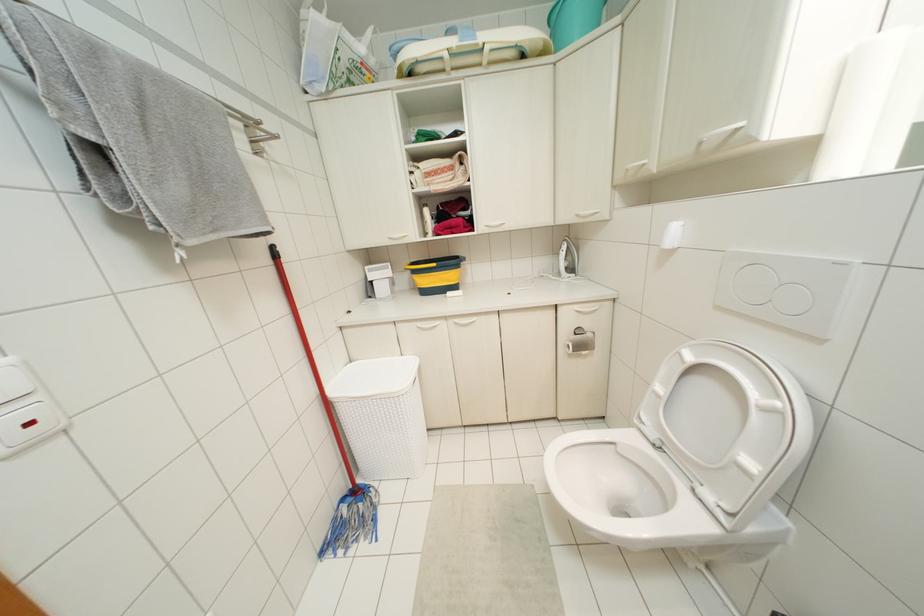
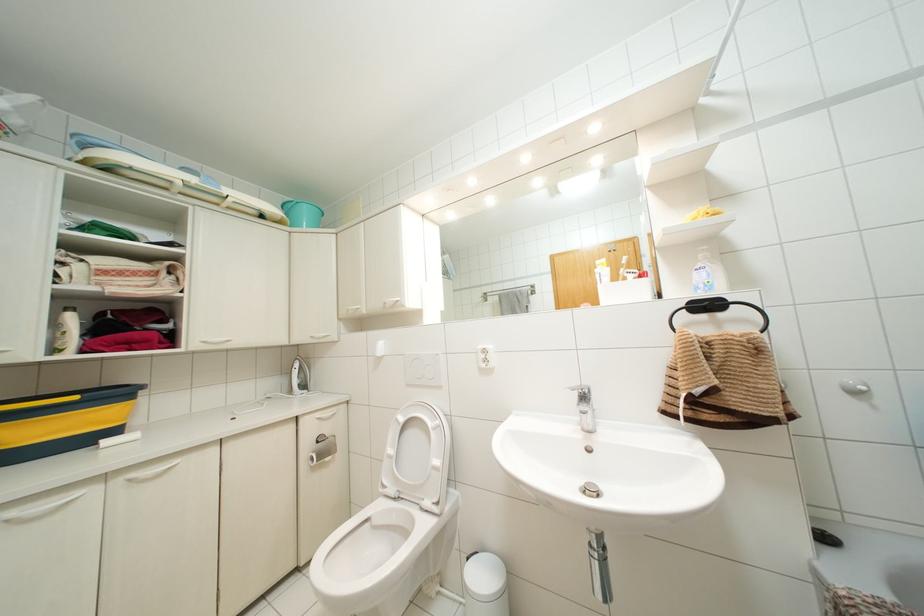
Find the pixel in the second image that matches the point at 659,387 in the first image.

(390, 450)